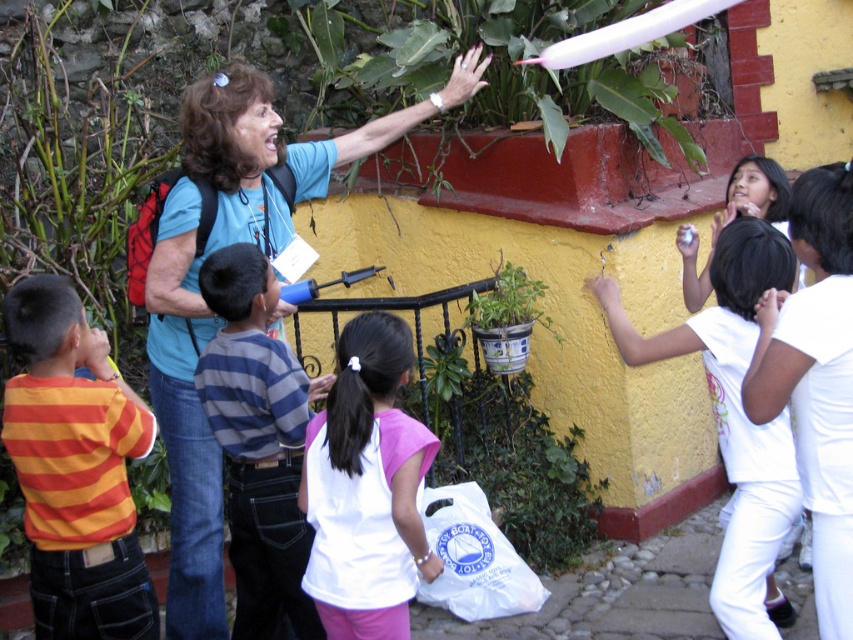
Is white cotton shirt at right positioned in front of green glazed pot at center?

Yes, it is.

Locate an element on the screen. This screenshot has height=640, width=853. white cotton shirt at right is located at coordinates (734, 417).

Between point (743, 257) and point (502, 346), which one is positioned in front?

Point (743, 257) is in front.

Where is `white cotton shirt at right`? The image size is (853, 640). white cotton shirt at right is located at coordinates (734, 417).

Can you confirm if green leafy plant at upper center is positioned above striped fabric shirt at center?

Yes.

Does point (666, 116) come farther from viewer compared to point (260, 438)?

Yes, it is behind point (260, 438).

This screenshot has width=853, height=640. I want to click on green leafy plant at upper center, so click(x=495, y=72).

The width and height of the screenshot is (853, 640). Describe the element at coordinates (366, 486) in the screenshot. I see `white matte shirt at center` at that location.

Which is above, white matte shirt at center or green glazed pot at center?

green glazed pot at center is above.

This screenshot has width=853, height=640. Identify the location of white matte shirt at center. (366, 486).